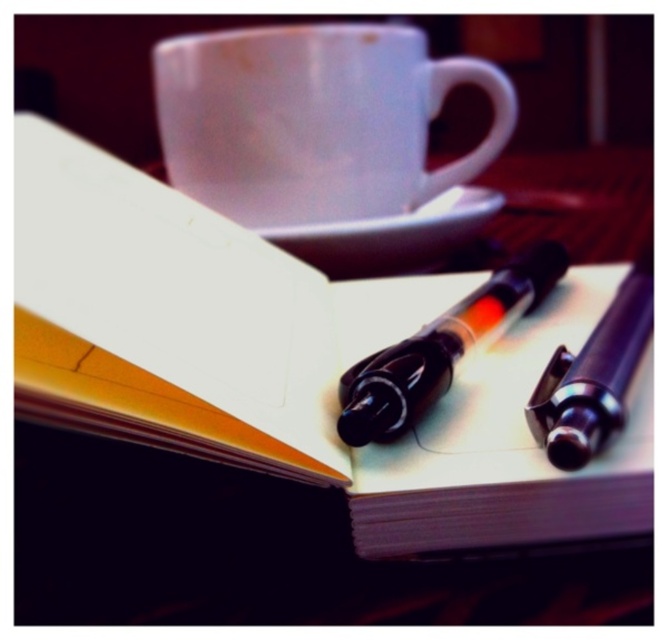
Question: Which point is closer to the camera?

Choices:
 (A) (313, 237)
 (B) (582, 417)
 (C) (501, 144)
 (D) (522, 298)

Answer: (B)

Question: Which point is closer to the camera taking this photo?

Choices:
 (A) (337, 246)
 (B) (73, 387)

Answer: (B)

Question: Is matte black pen at center to the right of white ceramic saucer at center from the viewer's perspective?

Choices:
 (A) yes
 (B) no

Answer: (A)

Question: Is matte black pen at center bigger than white ceramic saucer at center?

Choices:
 (A) no
 (B) yes

Answer: (A)

Question: Among these points, which one is farthest from the camera?

Choices:
 (A) (446, 481)
 (B) (476, 317)

Answer: (B)

Question: Does white glossy mug at upper center appear on the right side of white ceramic saucer at center?

Choices:
 (A) yes
 (B) no

Answer: (B)